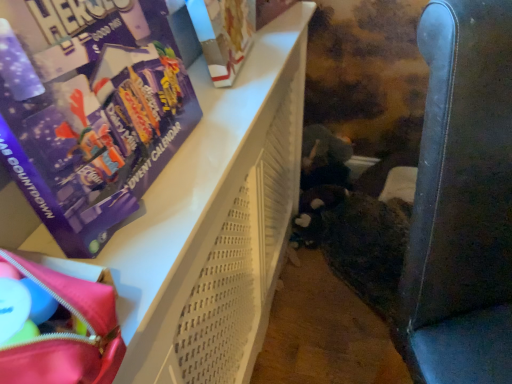
At what (x,y) coordinates should I click in order to perform the action: click on free space above white perforated plastic basket at upper left (from a real-world perspective). Please return your answer as a coordinate pair (x, y). Looking at the image, I should click on (221, 120).